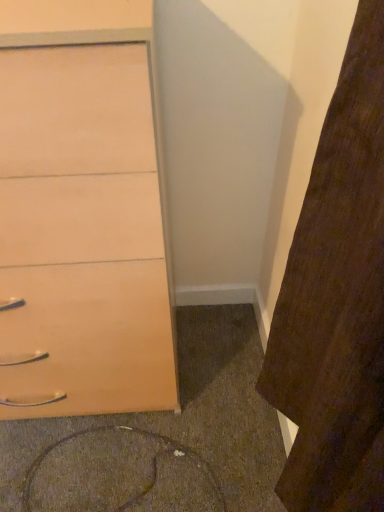
Locate an element on the screen. matte wood chest of drawers at left is located at coordinates (83, 210).

This screenshot has height=512, width=384. What do you see at coordinates (83, 210) in the screenshot?
I see `matte wood chest of drawers at left` at bounding box center [83, 210].

Find the location of a particular element. The height and width of the screenshot is (512, 384). matte wood chest of drawers at left is located at coordinates (83, 210).